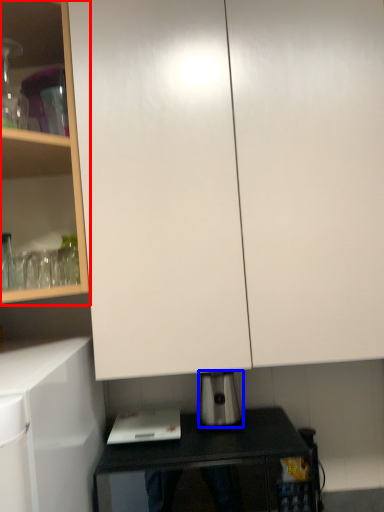
Question: Among these objects, which one is farthest to the camera, cabinetry (highlighted by a red box) or kitchen appliance (highlighted by a blue box)?

Choices:
 (A) cabinetry
 (B) kitchen appliance

Answer: (B)